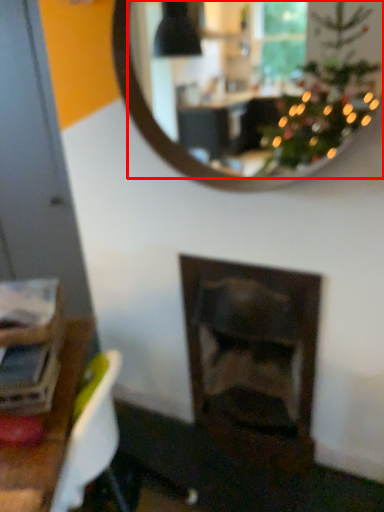
Question: From the image's perspective, what is the correct spatial positioning of mirror (annotated by the red box) in reference to fireplace?

Choices:
 (A) above
 (B) below

Answer: (A)